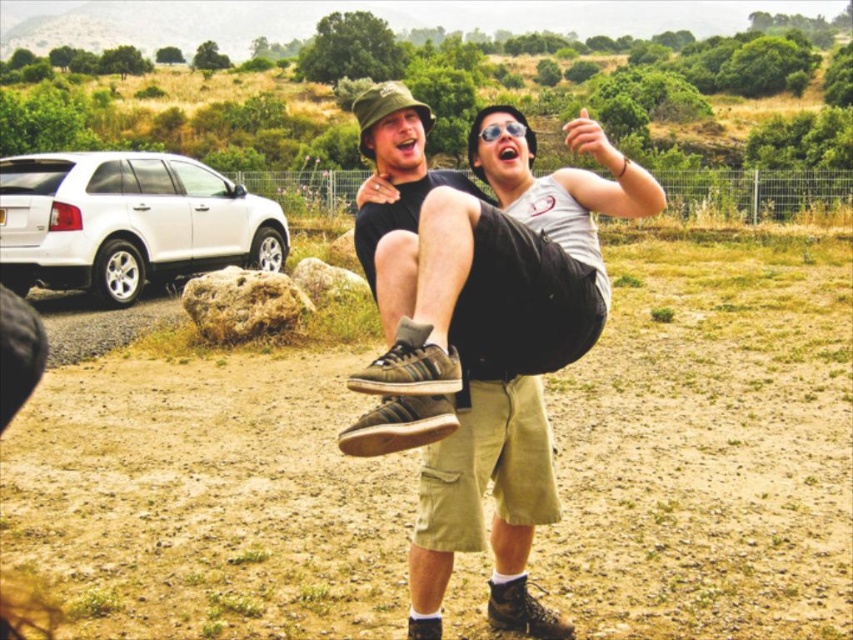
You are standing in the open field and want to walk towards the white matte suv at left. Which direction should you walk to reach it first, considering the brown sandy ground at center is in your path?

Since the brown sandy ground at center is closer to the viewer than the white matte suv at left, you should walk towards the white matte suv at left by going around the brown sandy ground at center to reach it first.

You are a drone operator trying to capture a photo of the brown sandy ground at center and the matte black shorts at center. The drone has a camera with a 10 feet wide lens. Will the drone be able to capture both objects in a single photo without moving the drone?

The brown sandy ground at center and matte black shorts at center are 9.95 feet apart from each other. Since the drone camera has a 10 feet wide lens, the distance between them is within the lens width. Therefore, the drone can capture both objects in a single photo without moving.

You are planning to place a small picnic basket on the brown sandy ground at center. However, there is already a matte black shorts at center occupying part of the area. Based on their widths, will the entire picnic basket fit on the remaining space?

The brown sandy ground at center might be wider than matte black shorts at center, so there might be enough space for the picnic basket to fit on the remaining area.